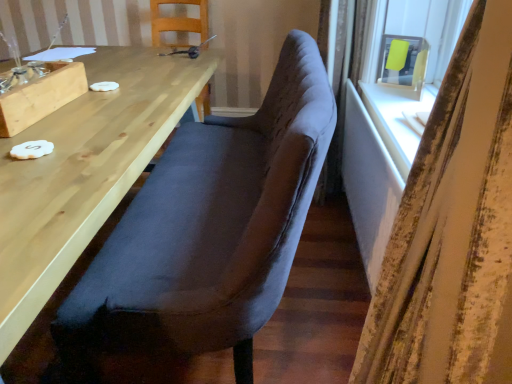
Where is `empty space that is ontop of wooden table at left, which is the 1th table from left to right (from a real-world perspective)`? This screenshot has height=384, width=512. empty space that is ontop of wooden table at left, which is the 1th table from left to right (from a real-world perspective) is located at coordinates (106, 90).